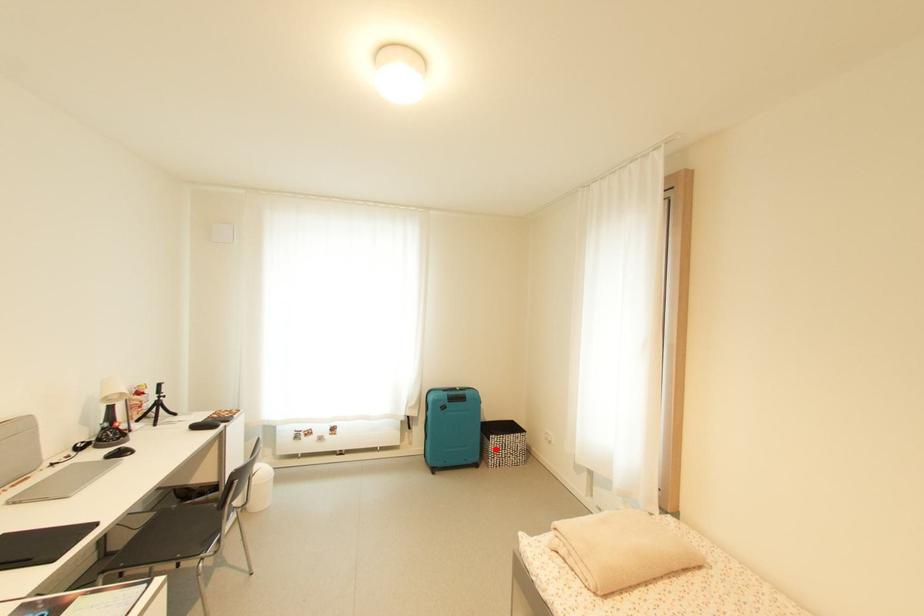
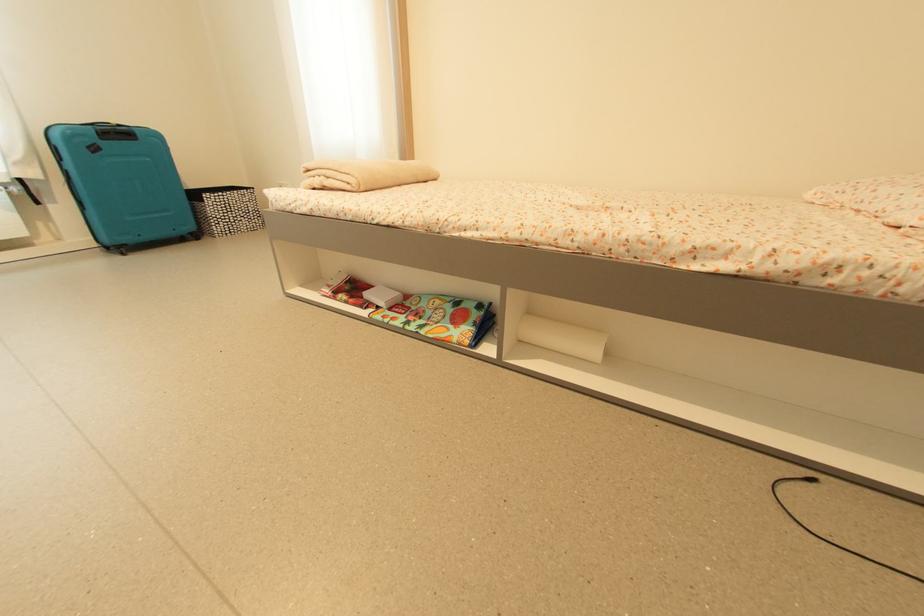
Question: I am providing you with two images of the same scene from different viewpoints. Given a red point in image1, look at the same physical point in image2. Is it:

Choices:
 (A) Closer to the viewpoint
 (B) Farther from the viewpoint

Answer: (A)